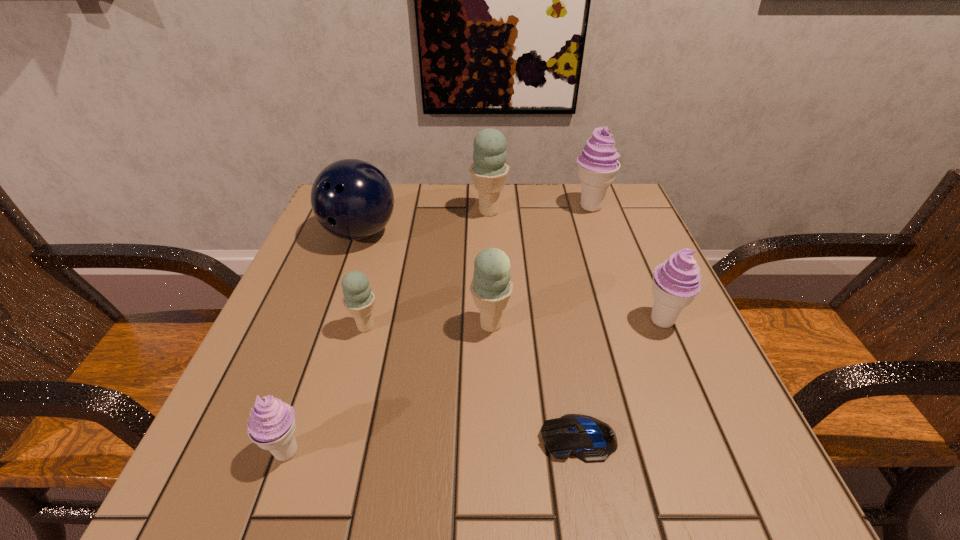
I want to click on vacant point located between the second nearest purple icecream and the fifth icecream from right to left, so click(514, 324).

The image size is (960, 540). I want to click on empty space between the blue bowling ball and the second biggest purple icecream, so click(511, 277).

At what (x,y) coordinates should I click in order to perform the action: click on vacant point located between the biggest purple icecream and the biggest blue ice cream. Please return your answer as a coordinate pair (x, y). Image resolution: width=960 pixels, height=540 pixels. Looking at the image, I should click on click(x=540, y=210).

Identify the location of the closest object to the smallest purple icecream. Image resolution: width=960 pixels, height=540 pixels. (359, 299).

At what (x,y) coordinates should I click in order to perform the action: click on object that is the closest to the nearest purple icecream. Please return your answer as a coordinate pair (x, y). The height and width of the screenshot is (540, 960). Looking at the image, I should click on (359, 299).

Image resolution: width=960 pixels, height=540 pixels. Find the location of `the second closest icecream relative to the shortest object`. the second closest icecream relative to the shortest object is located at coordinates (676, 282).

At what (x,y) coordinates should I click in order to perform the action: click on icecream that is the sixth closest to the blue bowling ball. Please return your answer as a coordinate pair (x, y). Looking at the image, I should click on (676, 282).

The width and height of the screenshot is (960, 540). Identify the location of blue ice cream that is the closest to the leftmost blue ice cream. (491, 287).

Identify which blue ice cream is the nearest to the smallest blue ice cream. Please provide its 2D coordinates. Your answer should be formatted as a tuple, i.e. [(x, y)], where the tuple contains the x and y coordinates of a point satisfying the conditions above.

[(491, 287)]

The height and width of the screenshot is (540, 960). What are the coordinates of `the closest purple icecream to the nearest purple icecream` in the screenshot? It's located at (676, 282).